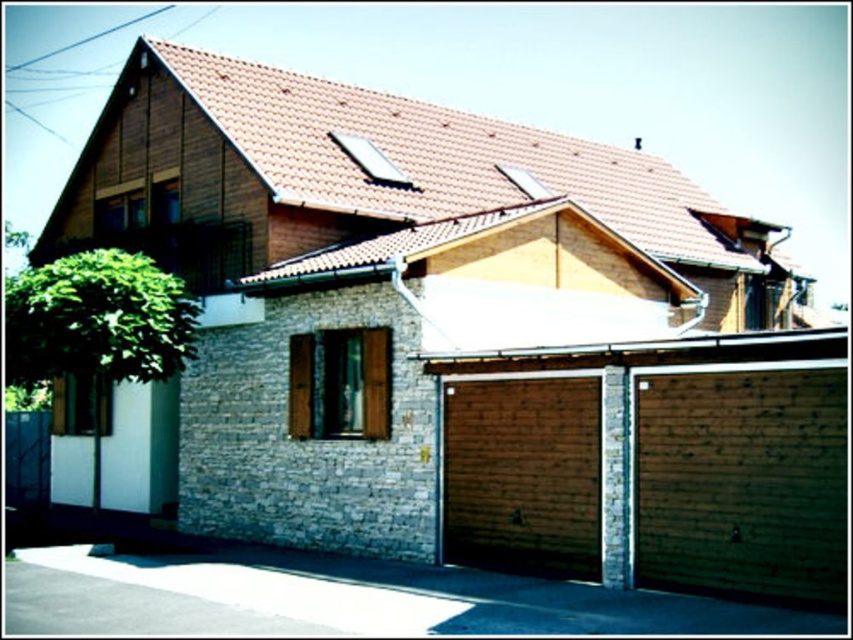
Question: Does wooden garage door at lower right appear on the right side of wooden at lower center?

Choices:
 (A) yes
 (B) no

Answer: (A)

Question: Which of the following is the closest to the observer?

Choices:
 (A) 476,516
 (B) 730,364

Answer: (B)

Question: Can you confirm if wooden garage door at lower right is positioned to the left of wooden at lower center?

Choices:
 (A) yes
 (B) no

Answer: (B)

Question: Can you confirm if wooden garage door at lower right is positioned to the left of wooden at lower center?

Choices:
 (A) yes
 (B) no

Answer: (B)

Question: Which object appears farthest from the camera in this image?

Choices:
 (A) wooden at lower center
 (B) wooden garage door at lower right

Answer: (A)